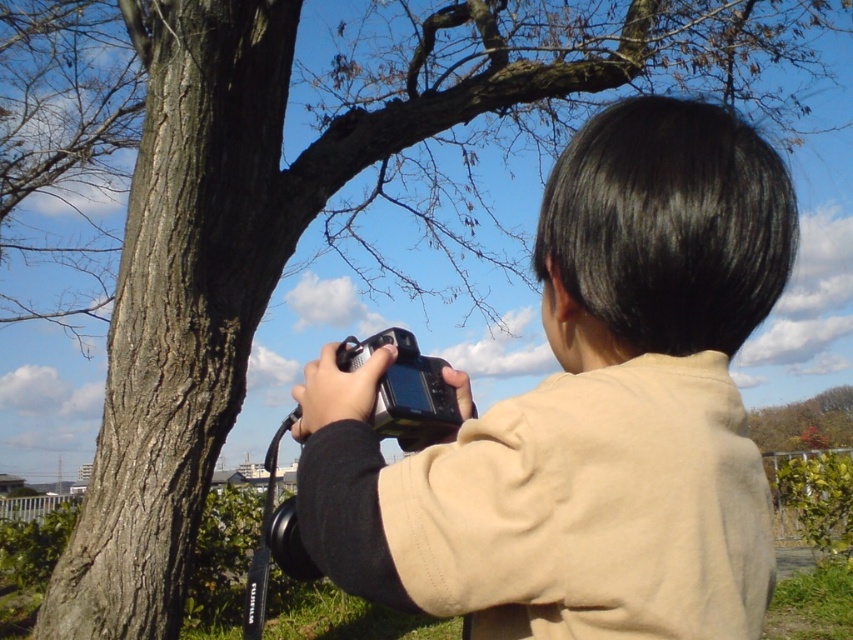
Question: Can you confirm if matte black camera at center is positioned above black plastic camera at center?

Choices:
 (A) yes
 (B) no

Answer: (A)

Question: Among these objects, which one is farthest from the camera?

Choices:
 (A) matte black camera at center
 (B) black plastic camera at center

Answer: (B)

Question: Can you confirm if matte black camera at center is wider than black plastic camera at center?

Choices:
 (A) yes
 (B) no

Answer: (A)

Question: In this image, where is matte black camera at center located relative to black plastic camera at center?

Choices:
 (A) left
 (B) right

Answer: (B)